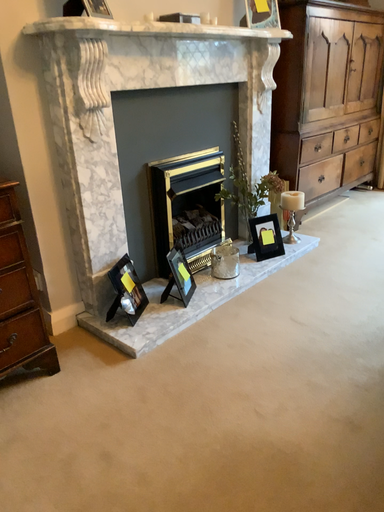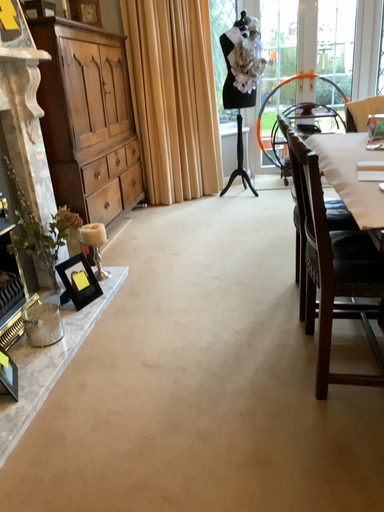
Question: How did the camera likely rotate when shooting the video?

Choices:
 (A) rotated left
 (B) rotated right

Answer: (B)